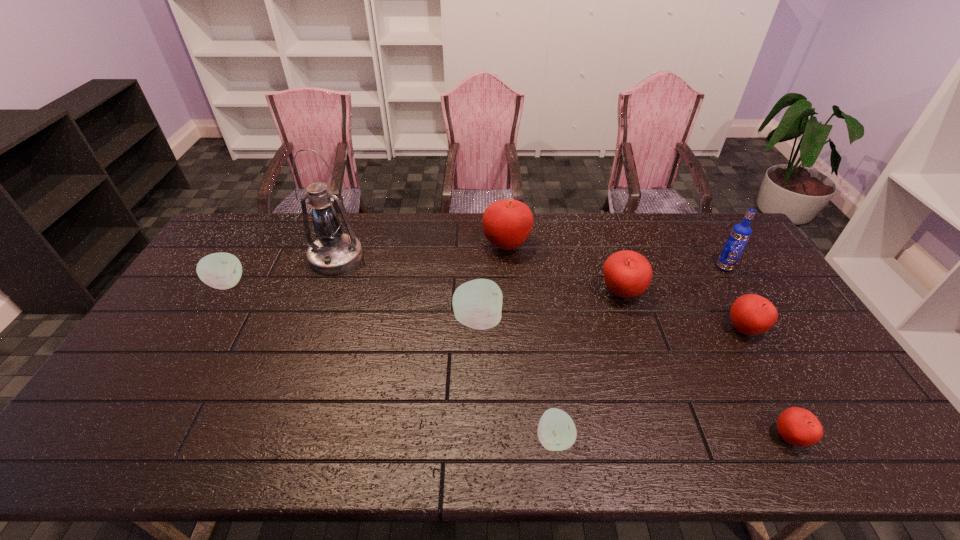
Identify the location of blank region between the second farthest red apple and the nearest white apple. The height and width of the screenshot is (540, 960). (588, 366).

Locate which object is the fifth closest to the oil lamp. Please provide its 2D coordinates. Your answer should be formatted as a tuple, i.e. [(x, y)], where the tuple contains the x and y coordinates of a point satisfying the conditions above.

[(627, 274)]

Locate an element on the screen. The height and width of the screenshot is (540, 960). the second closest object relative to the biggest red apple is located at coordinates (627, 274).

Find the location of a particular element. This screenshot has width=960, height=540. the sixth closest apple relative to the blue vodka is located at coordinates (556, 431).

Where is `apple that is the third closest to the leftmost red apple`? This screenshot has height=540, width=960. apple that is the third closest to the leftmost red apple is located at coordinates (751, 314).

Identify which red apple is located as the nearest to the second tallest object. Please provide its 2D coordinates. Your answer should be formatted as a tuple, i.e. [(x, y)], where the tuple contains the x and y coordinates of a point satisfying the conditions above.

[(751, 314)]

Locate which red apple ranks second in proximity to the eighth object from right to left. Please provide its 2D coordinates. Your answer should be formatted as a tuple, i.e. [(x, y)], where the tuple contains the x and y coordinates of a point satisfying the conditions above.

[(627, 274)]

Locate which white apple ranks in proximity to the farthest apple. Please provide its 2D coordinates. Your answer should be formatted as a tuple, i.e. [(x, y)], where the tuple contains the x and y coordinates of a point satisfying the conditions above.

[(477, 304)]

Identify which white apple is located as the second nearest to the third red apple from right to left. Please provide its 2D coordinates. Your answer should be formatted as a tuple, i.e. [(x, y)], where the tuple contains the x and y coordinates of a point satisfying the conditions above.

[(556, 431)]

Locate an element on the screen. This screenshot has height=540, width=960. vacant region that satisfies the following two spatial constraints: 1. on the back side of the third red apple from right to left; 2. on the right side of the eighth shortest object is located at coordinates (612, 267).